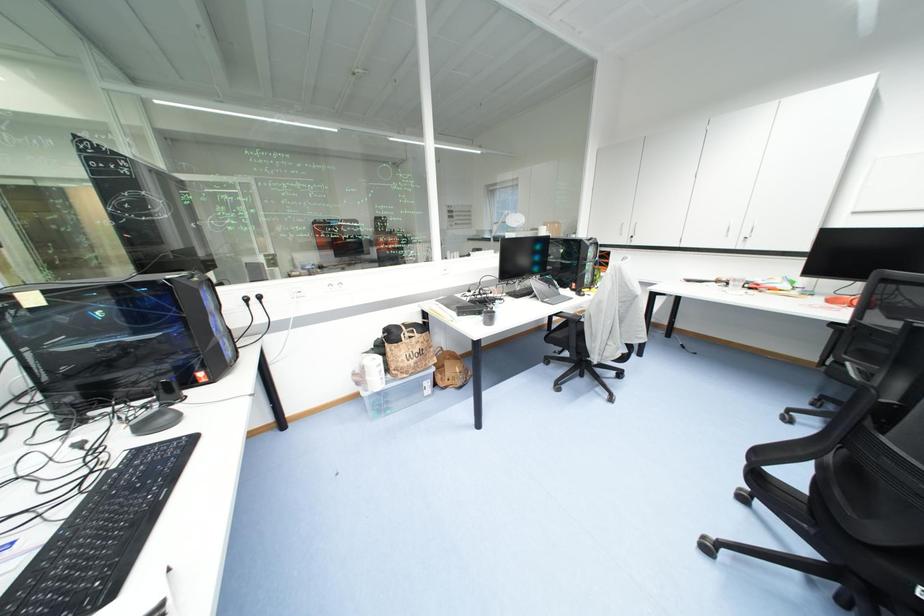
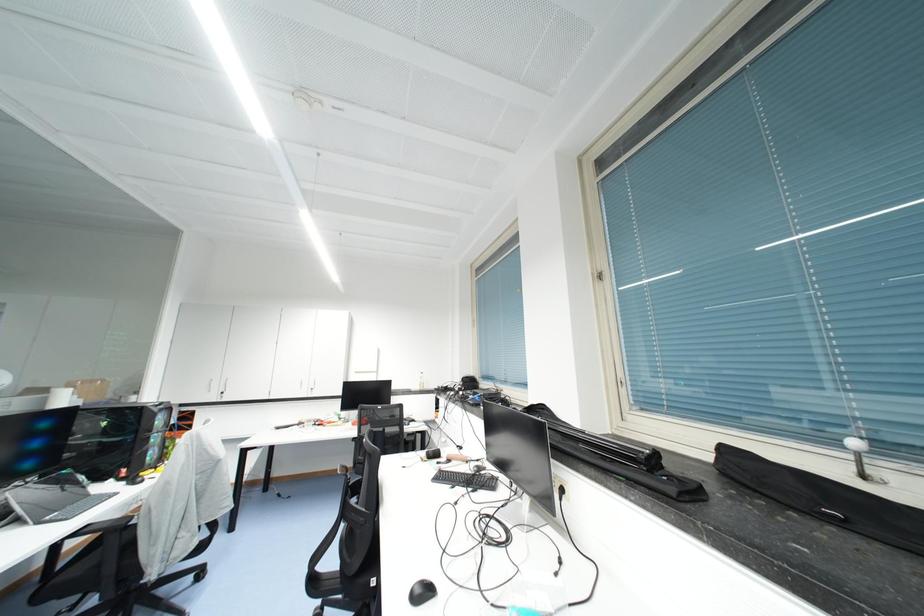
Based on the continuous images, in which direction is the camera rotating?

The camera rotated toward right-up.